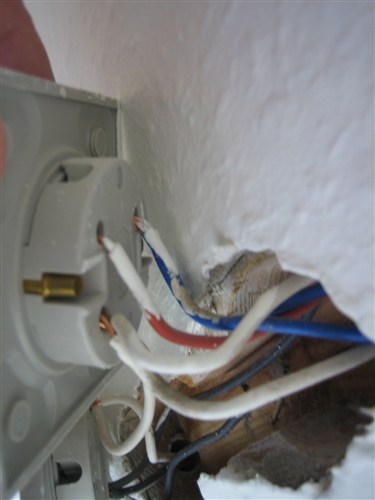
What are the coordinates of `black wire` in the screenshot? It's located at (224, 386), (177, 458), (150, 481), (129, 476).